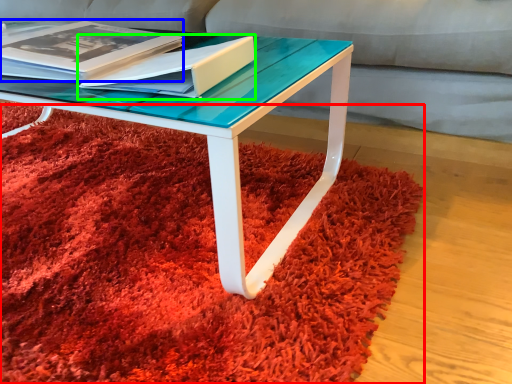
Question: Based on their relative distances, which object is nearer to mat (highlighted by a red box)? Choose from magazine (highlighted by a blue box) and paperback book (highlighted by a green box).

Choices:
 (A) magazine
 (B) paperback book

Answer: (B)